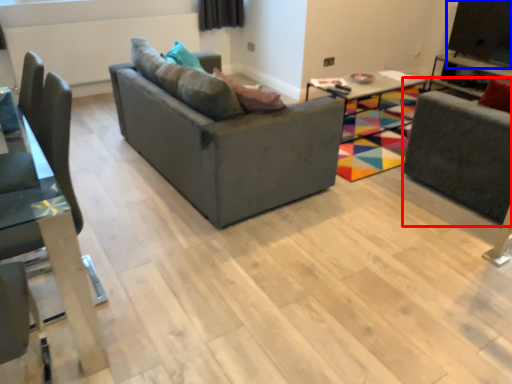
Question: Among these objects, which one is nearest to the camera, swivel chair (highlighted by a red box) or window screen (highlighted by a blue box)?

Choices:
 (A) swivel chair
 (B) window screen

Answer: (A)